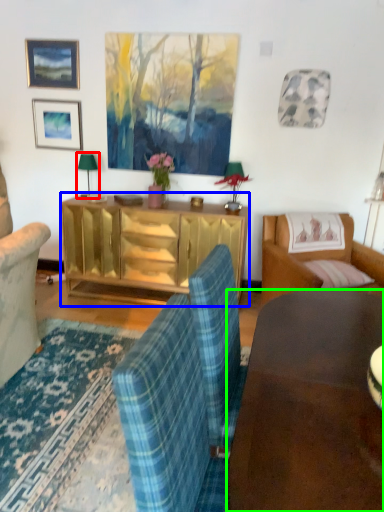
Question: Which object is positioned farthest from lamp (highlighted by a red box)? Select from cabinetry (highlighted by a blue box) and desk (highlighted by a green box).

Choices:
 (A) cabinetry
 (B) desk

Answer: (B)